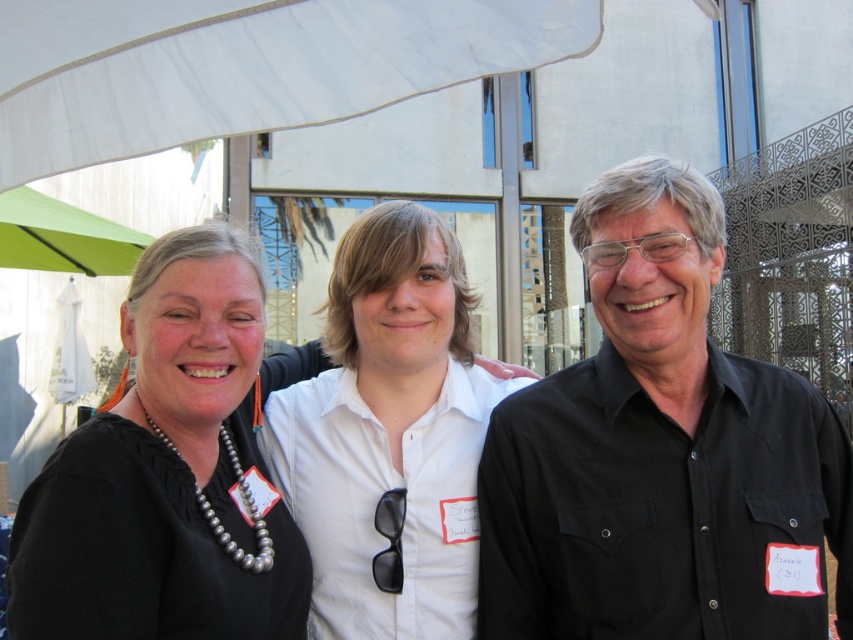
Can you confirm if black matte necklace at upper left is positioned above white fabric canopy at upper center?

Actually, black matte necklace at upper left is below white fabric canopy at upper center.

Can you confirm if black matte necklace at upper left is wider than white fabric canopy at upper center?

Incorrect, black matte necklace at upper left's width does not surpass white fabric canopy at upper center's.

Is point (225, 355) positioned before point (276, 84)?

No, (225, 355) is behind (276, 84).

Identify the location of black matte necklace at upper left. This screenshot has height=640, width=853. (170, 472).

Is black matte necklace at upper left further to the viewer compared to green fabric umbrella at upper left?

That is False.

Is black matte necklace at upper left smaller than green fabric umbrella at upper left?

Yes.

Which is behind, point (294, 536) or point (114, 269)?

The point (114, 269) is behind.

In order to click on black matte necklace at upper left in this screenshot , I will do `click(170, 472)`.

Does black matte shirt at center have a greater height compared to black matte necklace at upper left?

Indeed, black matte shirt at center has a greater height compared to black matte necklace at upper left.

How far apart are black matte shirt at center and black matte necklace at upper left?

The distance of black matte shirt at center from black matte necklace at upper left is 1.12 meters.

Who is more distant from viewer, (491,602) or (146,337)?

Point (491,602)

Where is `black matte shirt at center`? This screenshot has height=640, width=853. black matte shirt at center is located at coordinates (660, 452).